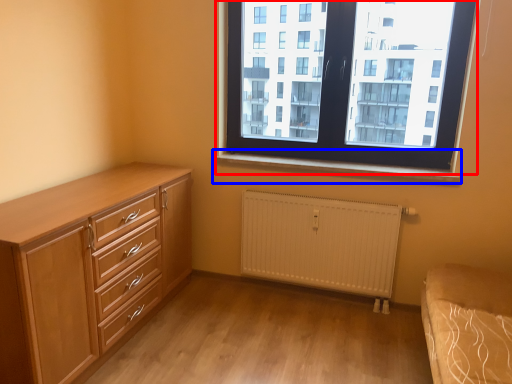
Question: Which object is further to the camera taking this photo, window (highlighted by a red box) or window sill (highlighted by a blue box)?

Choices:
 (A) window
 (B) window sill

Answer: (B)